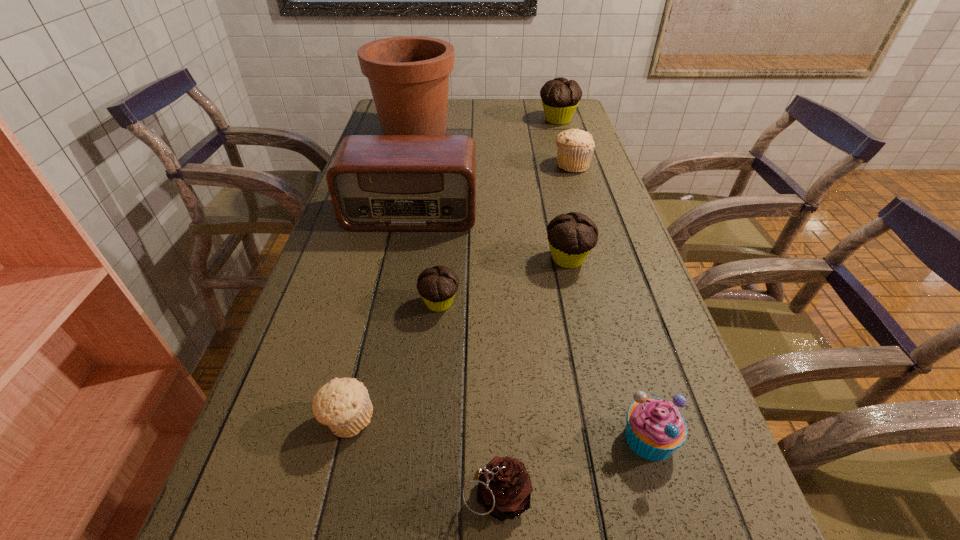
Locate an element on the screen. The width and height of the screenshot is (960, 540). radio receiver that is positioned at the left edge is located at coordinates (376, 182).

Where is `muffin that is at the left edge`? muffin that is at the left edge is located at coordinates (343, 405).

This screenshot has width=960, height=540. I want to click on object located in the far left corner section of the desktop, so click(408, 76).

Where is `object positioned at the far right corner`? object positioned at the far right corner is located at coordinates (560, 97).

In the image, there is a desktop. Identify the location of blank space at the far edge. The height and width of the screenshot is (540, 960). coord(533,117).

You are a GUI agent. You are given a task and a screenshot of the screen. Output one action in this format:
    pyautogui.click(x=<x>, y=<y>)
    Task: Click on the free space at the left edge of the desktop
    
    Given the screenshot: What is the action you would take?
    pyautogui.click(x=277, y=367)

You are a GUI agent. You are given a task and a screenshot of the screen. Output one action in this format:
    pyautogui.click(x=<x>, y=<y>)
    Task: Click on the free space at the right edge of the desktop
    The image size is (960, 540).
    Given the screenshot: What is the action you would take?
    pyautogui.click(x=611, y=225)

Where is `free space at the far right corner of the desktop`? The image size is (960, 540). free space at the far right corner of the desktop is located at coordinates (583, 110).

Identify the location of vacant space in between the fourth farthest object and the third farthest muffin. The width and height of the screenshot is (960, 540). (490, 236).

The height and width of the screenshot is (540, 960). In order to click on vacant area between the eighth shortest object and the nearer beige muffin in this screenshot , I will do `click(379, 316)`.